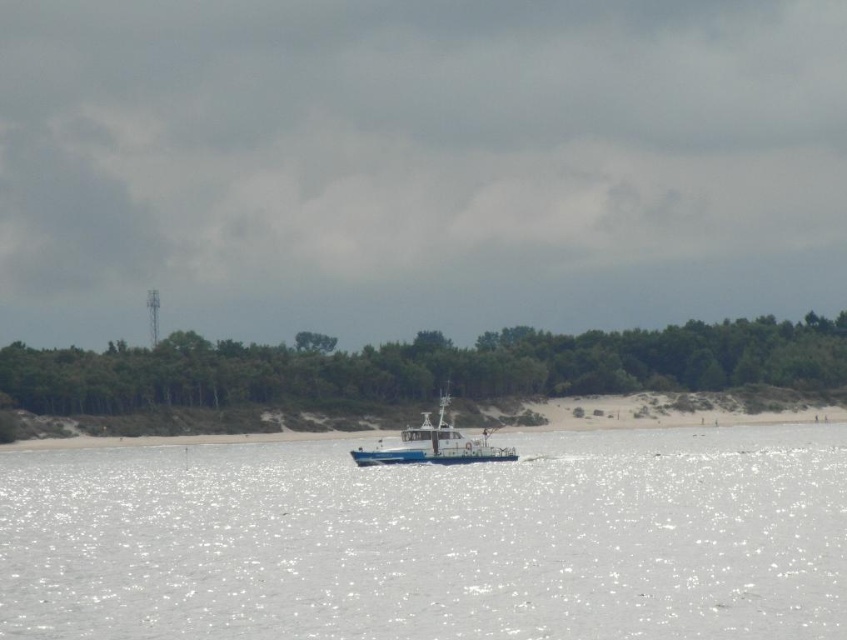
From the picture: You are a photographer planning to capture the entire white glossy water at center and white glossy boat at center in one frame. Based on the scene, which object would occupy more space in your photo?

The white glossy water at center occupies more space in the photo because it is larger in size than the white glossy boat at center.

You are a photographer trying to capture the reflection of the boat in the water. Based on the scene, will the reflection of the white glossy boat at center be fully visible in the white glossy water at center?

The white glossy water at center has a greater height compared to the white glossy boat at center, so the reflection of the white glossy boat at center should be fully visible in the white glossy water at center.